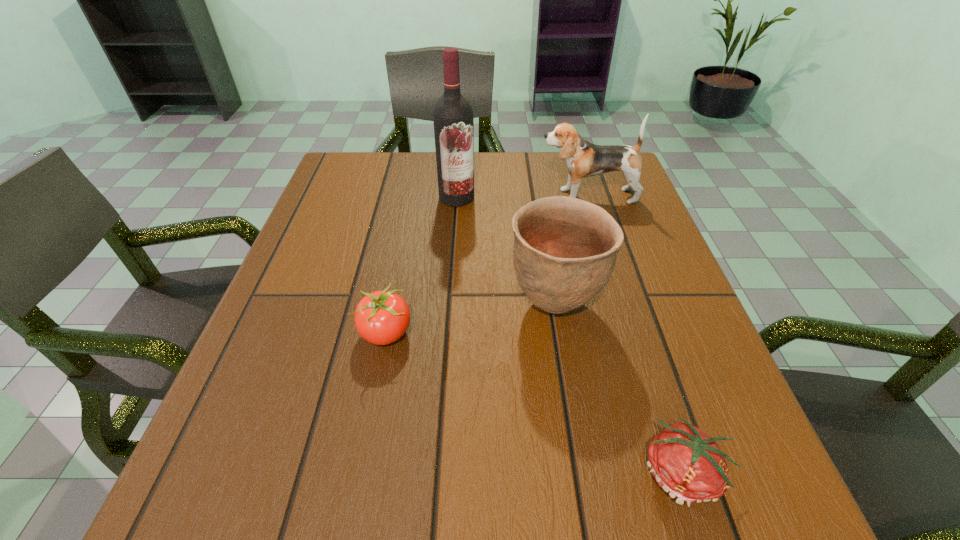
In order to click on free space that is in between the leftmost object and the tallest object in this screenshot , I will do `click(421, 266)`.

The image size is (960, 540). In order to click on unoccupied area between the puppy and the nearest object in this screenshot , I will do `click(635, 335)`.

You are a GUI agent. You are given a task and a screenshot of the screen. Output one action in this format:
    pyautogui.click(x=<x>, y=<y>)
    Task: Click on the unoccupied position between the fourth object from right to left and the pottery
    Image resolution: width=960 pixels, height=540 pixels.
    Given the screenshot: What is the action you would take?
    pyautogui.click(x=505, y=250)

Locate an element on the screen. The width and height of the screenshot is (960, 540). vacant point located between the pottery and the left tomato is located at coordinates (470, 319).

The height and width of the screenshot is (540, 960). In order to click on vacant space that's between the pottery and the left tomato in this screenshot , I will do `click(470, 319)`.

Locate an element on the screen. The image size is (960, 540). empty space that is in between the right tomato and the puppy is located at coordinates (635, 335).

What are the coordinates of `empty location between the second object from left to right and the puppy` in the screenshot? It's located at (522, 197).

Identify which object is the nearest to the pottery. Please provide its 2D coordinates. Your answer should be formatted as a tuple, i.e. [(x, y)], where the tuple contains the x and y coordinates of a point satisfying the conditions above.

[(382, 317)]

You are a GUI agent. You are given a task and a screenshot of the screen. Output one action in this format:
    pyautogui.click(x=<x>, y=<y>)
    Task: Click on the object that can be found as the fourth closest to the wine bottle
    
    Given the screenshot: What is the action you would take?
    pyautogui.click(x=686, y=463)

Identify the location of blank space that satisfies the following two spatial constraints: 1. on the back side of the nearest object; 2. at the face of the puppy. (592, 196).